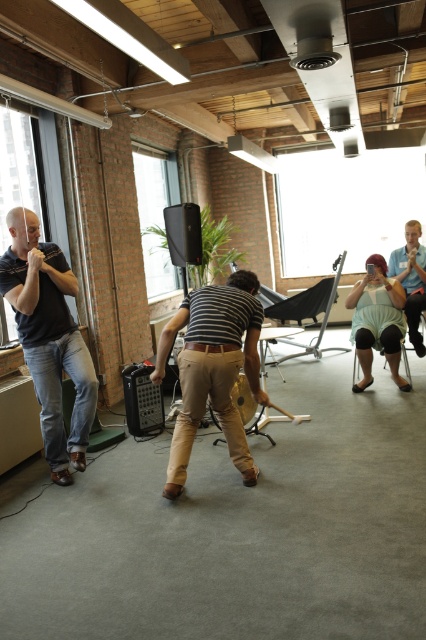
You are a photographer at the event and want to capture both the striped cotton shirt at center and the brown leather belt at center in a single frame. Which object should you focus on first to ensure both are in the frame?

The striped cotton shirt at center is taller than the brown leather belt at center, so you should focus on the striped cotton shirt at center first to ensure both are in the frame.

You are a photographer at the event and want to capture a photo of the matte blue shirt at center and light blue denim jeans at lower right. Based on their positions, which object is located lower in the image?

The matte blue shirt at center is positioned under light blue denim jeans at lower right, so the matte blue shirt at center is lower in the image.